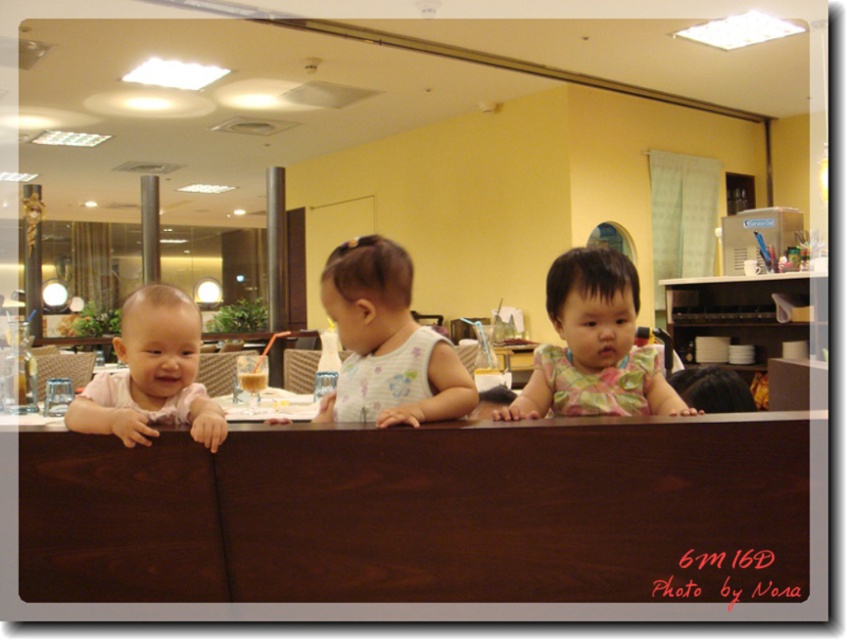
Question: Can you confirm if dark wood table at center is bigger than floral fabric dress at center?

Choices:
 (A) yes
 (B) no

Answer: (A)

Question: Which point is farther to the camera?

Choices:
 (A) dark wood table at center
 (B) matte pink shirt at left
 (C) floral fabric dress at center
 (D) white floral tank top at center

Answer: (C)

Question: Considering the real-world distances, which object is closest to the floral fabric dress at center?

Choices:
 (A) white floral tank top at center
 (B) dark wood table at center

Answer: (A)

Question: Does dark wood table at center have a smaller size compared to matte pink shirt at left?

Choices:
 (A) no
 (B) yes

Answer: (A)

Question: Which is farther from the white floral tank top at center?

Choices:
 (A) dark wood table at center
 (B) floral fabric dress at center
 (C) matte pink shirt at left

Answer: (C)

Question: Is the position of dark wood table at center less distant than that of white floral tank top at center?

Choices:
 (A) yes
 (B) no

Answer: (A)